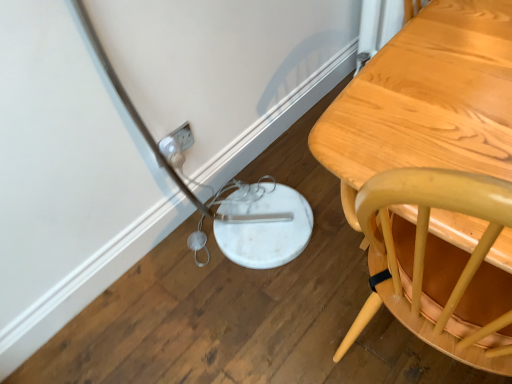
Question: Should I look upward or downward to see white plastic plug at lower left?

Choices:
 (A) up
 (B) down

Answer: (A)

Question: Are light brown wooden table at right and white plastic plug at lower left making contact?

Choices:
 (A) yes
 (B) no

Answer: (B)

Question: From a real-world perspective, is light brown wooden table at right physically above white plastic plug at lower left?

Choices:
 (A) yes
 (B) no

Answer: (A)

Question: Is white plastic plug at lower left at the back of light brown wooden table at right?

Choices:
 (A) no
 (B) yes

Answer: (A)

Question: Can you confirm if light brown wooden table at right is positioned to the right of white plastic plug at lower left?

Choices:
 (A) no
 (B) yes

Answer: (B)

Question: Is light brown wooden table at right further to the viewer compared to white plastic plug at lower left?

Choices:
 (A) no
 (B) yes

Answer: (A)

Question: From the image's perspective, does light brown wooden table at right appear lower than white plastic plug at lower left?

Choices:
 (A) yes
 (B) no

Answer: (A)

Question: From a real-world perspective, does white plastic plug at lower left stand above light brown wooden table at right?

Choices:
 (A) yes
 (B) no

Answer: (B)

Question: Is white plastic plug at lower left further to camera compared to light brown wooden table at right?

Choices:
 (A) no
 (B) yes

Answer: (B)

Question: Considering the relative sizes of white plastic plug at lower left and light brown wooden table at right in the image provided, is white plastic plug at lower left thinner than light brown wooden table at right?

Choices:
 (A) no
 (B) yes

Answer: (B)

Question: Does white plastic plug at lower left have a greater width compared to light brown wooden table at right?

Choices:
 (A) yes
 (B) no

Answer: (B)

Question: Is white plastic plug at lower left beside light brown wooden table at right?

Choices:
 (A) no
 (B) yes

Answer: (A)

Question: From the image's perspective, is white plastic plug at lower left located beneath light brown wooden table at right?

Choices:
 (A) no
 (B) yes

Answer: (A)

Question: In terms of size, does white plastic plug at lower left appear bigger or smaller than light brown wooden table at right?

Choices:
 (A) big
 (B) small

Answer: (B)